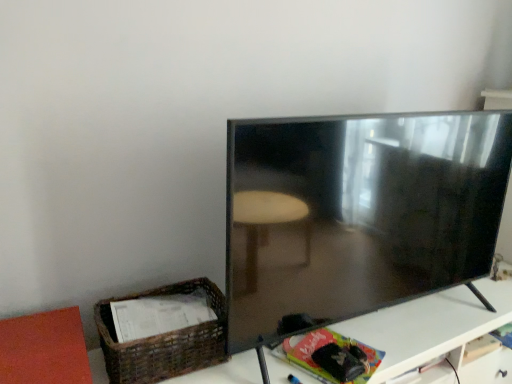
Locate an element on the screen. Image resolution: width=512 pixels, height=384 pixels. woven brown basket at lower left is located at coordinates (164, 340).

Describe the element at coordinates (357, 214) in the screenshot. This screenshot has height=384, width=512. I see `matte black tv at right` at that location.

The height and width of the screenshot is (384, 512). Find the location of `woven brown basket at lower left`. woven brown basket at lower left is located at coordinates (164, 340).

Considering their positions, is woven brown basket at lower left located in front of or behind matte black tv at right?

Visually, woven brown basket at lower left is located behind matte black tv at right.

From a real-world perspective, which is physically below, woven brown basket at lower left or matte black tv at right?

From a 3D spatial view, woven brown basket at lower left is below.

Is woven brown basket at lower left to the left or to the right of matte black tv at right in the image?

woven brown basket at lower left is to the left of matte black tv at right.

In terms of size, does matte black tv at right appear bigger or smaller than woven brown basket at lower left?

Clearly, matte black tv at right is larger in size than woven brown basket at lower left.

Considering the sizes of matte black tv at right and woven brown basket at lower left in the image, is matte black tv at right taller or shorter than woven brown basket at lower left?

Considering their sizes, matte black tv at right has more height than woven brown basket at lower left.

Visually, is matte black tv at right positioned to the left or to the right of woven brown basket at lower left?

From the image, it's evident that matte black tv at right is to the right of woven brown basket at lower left.

From the image's perspective, which one is positioned higher, matte black tv at right or woven brown basket at lower left?

matte black tv at right, from the image's perspective.

From the image's perspective, is matte black tv at right below white glossy table at lower right?

No.

Is matte black tv at right to the left of white glossy table at lower right from the viewer's perspective?

In fact, matte black tv at right is to the right of white glossy table at lower right.

Can you confirm if matte black tv at right is shorter than white glossy table at lower right?

In fact, matte black tv at right may be taller than white glossy table at lower right.

Is matte black tv at right oriented towards white glossy table at lower right?

No, matte black tv at right is not turned towards white glossy table at lower right.

The image size is (512, 384). In order to click on table on the left of the matte black tv at right in this screenshot , I will do `click(430, 325)`.

Would you consider white glossy table at lower right to be distant from matte black tv at right?

No, white glossy table at lower right is not far away from matte black tv at right.

Is matte black tv at right completely or partially inside white glossy table at lower right?

Actually, matte black tv at right is outside white glossy table at lower right.

From the image's perspective, is white glossy table at lower right below matte black tv at right?

Correct, white glossy table at lower right appears lower than matte black tv at right in the image.

Is woven brown basket at lower left facing away from white glossy table at lower right?

No, white glossy table at lower right is not at the back of woven brown basket at lower left.

Is point (182, 284) farther from camera compared to point (238, 358)?

Yes, it is.

Between woven brown basket at lower left and white glossy table at lower right, which one has less height?

With less height is woven brown basket at lower left.

Is white glossy table at lower right not close to woven brown basket at lower left?

white glossy table at lower right is actually quite close to woven brown basket at lower left.

Is point (490, 300) positioned behind point (115, 342)?

Yes, it is behind point (115, 342).

In terms of height, does white glossy table at lower right look taller or shorter compared to woven brown basket at lower left?

In the image, white glossy table at lower right appears to be taller than woven brown basket at lower left.

There is a woven brown basket at lower left. Find the location of `television above it (from a real-world perspective)`. television above it (from a real-world perspective) is located at coordinates (357, 214).

You are a GUI agent. You are given a task and a screenshot of the screen. Output one action in this format:
    pyautogui.click(x=<x>, y=<y>)
    Task: Click on the television on the right of woven brown basket at lower left
    The image size is (512, 384).
    Given the screenshot: What is the action you would take?
    pyautogui.click(x=357, y=214)

Based on their spatial positions, is matte black tv at right or white glossy table at lower right further from woven brown basket at lower left?

Among the two, white glossy table at lower right is located further to woven brown basket at lower left.

Looking at the image, which one is located further to white glossy table at lower right, woven brown basket at lower left or matte black tv at right?

woven brown basket at lower left is further to white glossy table at lower right.

Which object lies nearer to the anchor point matte black tv at right, woven brown basket at lower left or white glossy table at lower right?

The object closer to matte black tv at right is white glossy table at lower right.

Consider the image. Looking at the image, which one is located further to woven brown basket at lower left, white glossy table at lower right or matte black tv at right?

white glossy table at lower right lies further to woven brown basket at lower left than the other object.

Considering their positions, is white glossy table at lower right positioned closer to matte black tv at right than woven brown basket at lower left?

white glossy table at lower right is closer to matte black tv at right.

Which object lies further to the anchor point white glossy table at lower right, matte black tv at right or woven brown basket at lower left?

woven brown basket at lower left is further to white glossy table at lower right.

This screenshot has height=384, width=512. In order to click on table between woven brown basket at lower left and matte black tv at right from left to right in this screenshot , I will do `click(430, 325)`.